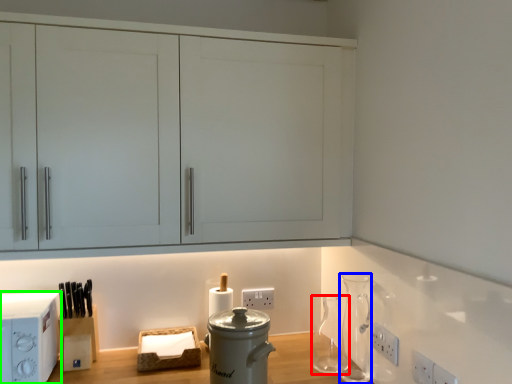
Question: Estimate the real-world distances between objects in this image. Which object is farther from glass vase (highlighted by a red box), vase (highlighted by a blue box) or home appliance (highlighted by a green box)?

Choices:
 (A) vase
 (B) home appliance

Answer: (B)